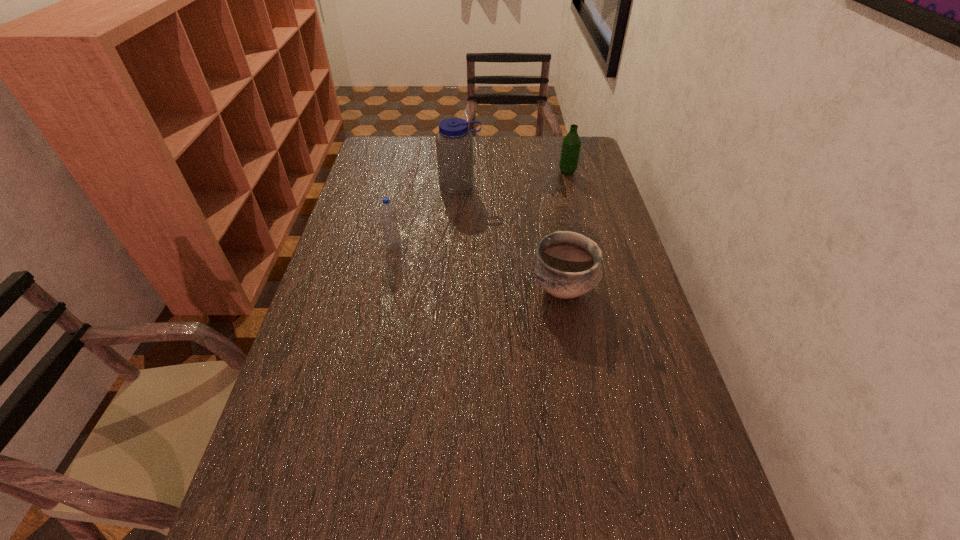
Where is `vacant area situated 0.310m on the left of the nearest object`? This screenshot has width=960, height=540. vacant area situated 0.310m on the left of the nearest object is located at coordinates (416, 289).

I want to click on object that is at the far edge, so click(x=570, y=150).

Where is `object that is at the left edge`? Image resolution: width=960 pixels, height=540 pixels. object that is at the left edge is located at coordinates (388, 215).

Identify the location of water bottle located at the right edge. pos(570,150).

This screenshot has height=540, width=960. Find the location of `pottery present at the right edge`. pottery present at the right edge is located at coordinates tap(566, 264).

Find the location of a particular element. This screenshot has height=540, width=960. object located in the far right corner section of the desktop is located at coordinates (570, 150).

Image resolution: width=960 pixels, height=540 pixels. I want to click on vacant space at the far edge, so click(498, 159).

Where is `vacant space at the left edge`? The height and width of the screenshot is (540, 960). vacant space at the left edge is located at coordinates (328, 262).

Where is `free region at the right edge of the desktop`? free region at the right edge of the desktop is located at coordinates (673, 519).

What are the coordinates of `vacant space at the far right corner of the desktop` in the screenshot? It's located at (596, 163).